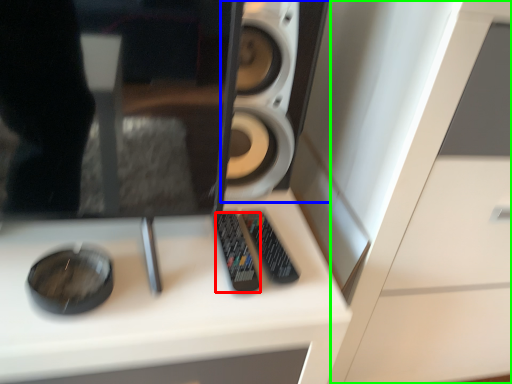
Question: Which object is positioned farthest from control (highlighted by a red box)? Select from speaker (highlighted by a blue box) and dresser (highlighted by a green box).

Choices:
 (A) speaker
 (B) dresser

Answer: (B)